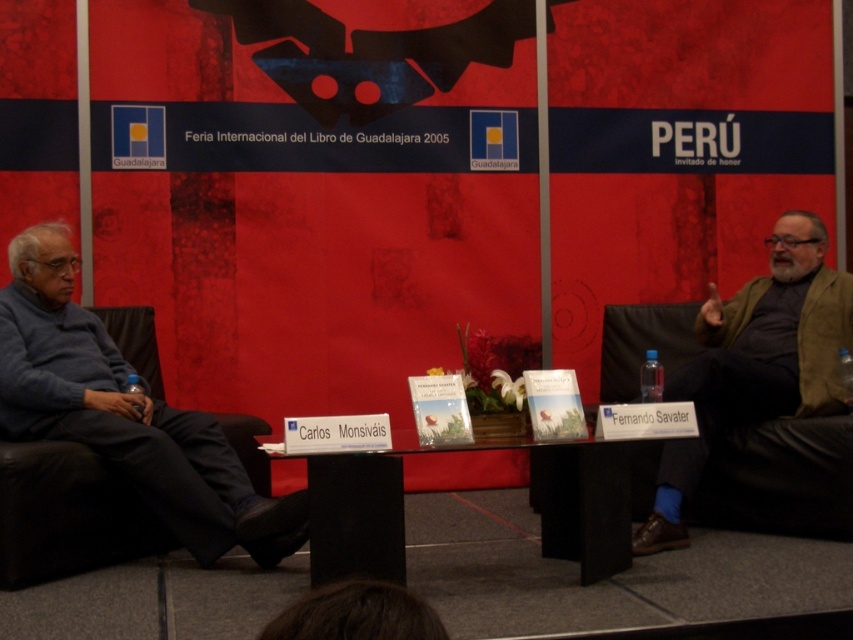
Which is more to the right, blue sweater at left or brown suede jacket at right?

Positioned to the right is brown suede jacket at right.

Between blue sweater at left and brown suede jacket at right, which one is positioned lower?

Positioned lower is blue sweater at left.

Identify the location of blue sweater at left. The image size is (853, 640). (125, 413).

Is blue sweater at left bigger than transparent glass table at center?

Yes.

Between point (144, 416) and point (608, 554), which one is positioned behind?

The point (144, 416) is behind.

Does point (229, 467) lie in front of point (364, 552)?

No.

Identify the location of blue sweater at left. (125, 413).

Which is more to the right, brown suede jacket at right or transparent glass table at center?

From the viewer's perspective, brown suede jacket at right appears more on the right side.

Measure the distance between brown suede jacket at right and camera.

brown suede jacket at right and camera are 3.43 meters apart from each other.

This screenshot has width=853, height=640. I want to click on brown suede jacket at right, so click(755, 364).